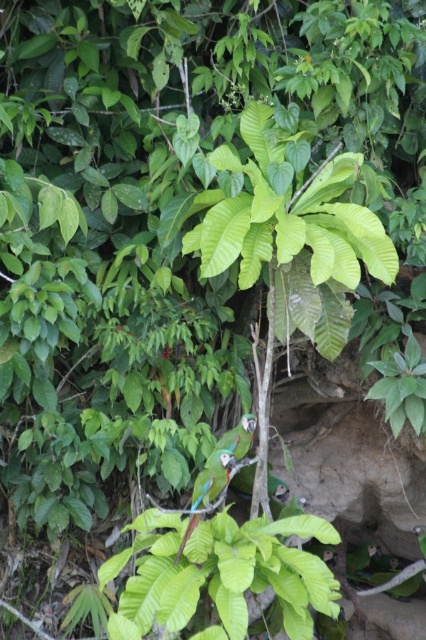
You are a birdwatcher observing two parrots in a tropical forest. You see the green glossy parrot at center and the shiny green parrot at center. Which parrot is closer to you?

The green glossy parrot at center is closer to you because it is positioned further to the viewer than the shiny green parrot at center.

You are a birdwatcher observing two parrots in a tropical forest. You notice a green glossy parrot at center and a shiny green parrot at center. Which parrot is positioned higher in the tree?

The green glossy parrot at center is positioned higher than the shiny green parrot at center.